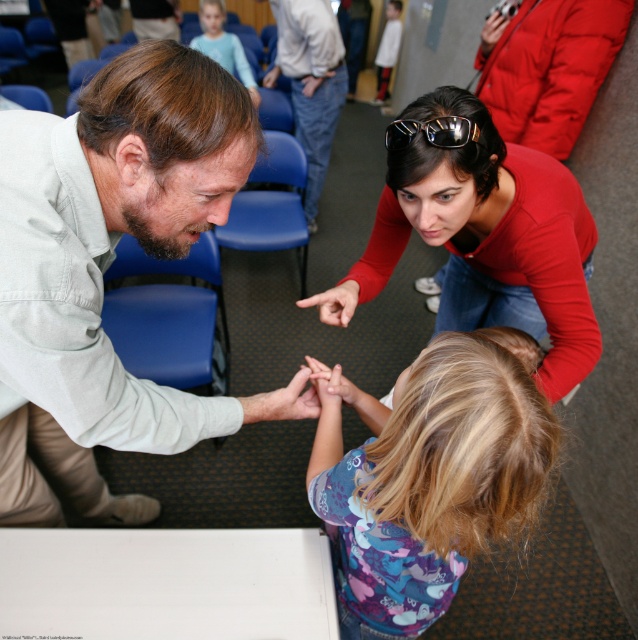
Can you confirm if light blue jeans at center is bigger than white cotton shirt at upper center?

Correct, light blue jeans at center is larger in size than white cotton shirt at upper center.

Looking at this image, which is more to the right, light blue jeans at center or white cotton shirt at upper center?

white cotton shirt at upper center is more to the right.

Locate an element on the screen. This screenshot has height=640, width=638. light blue jeans at center is located at coordinates (309, 83).

This screenshot has width=638, height=640. Find the location of `light blue jeans at center`. light blue jeans at center is located at coordinates coord(309,83).

Who is lower down, purple cotton shirt at lower center or red matte shirt at upper center?

purple cotton shirt at lower center

Which is in front, point (508, 388) or point (426, 108)?

Point (508, 388)

Identify the location of purple cotton shirt at lower center. (427, 477).

Does red matte shirt at upper center have a lesser height compared to white cotton shirt at upper center?

Yes.

Can you confirm if red matte shirt at upper center is positioned below white cotton shirt at upper center?

Correct, red matte shirt at upper center is located below white cotton shirt at upper center.

Identify the location of red matte shirt at upper center. (486, 240).

At what (x,y) coordinates should I click in order to perform the action: click on red matte shirt at upper center. Please return your answer as a coordinate pair (x, y). The width and height of the screenshot is (638, 640). Looking at the image, I should click on (486, 240).